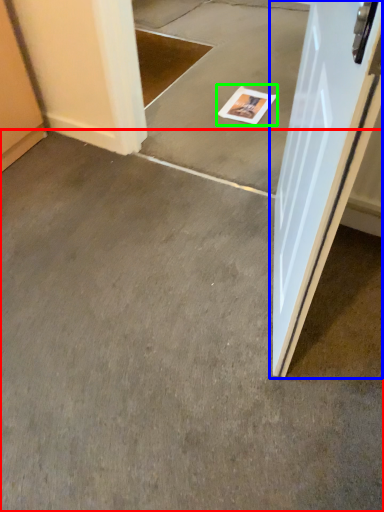
Question: Which is farther away from concrete (highlighted by a red box)? door (highlighted by a blue box) or magazine (highlighted by a green box)?

Choices:
 (A) door
 (B) magazine

Answer: (B)